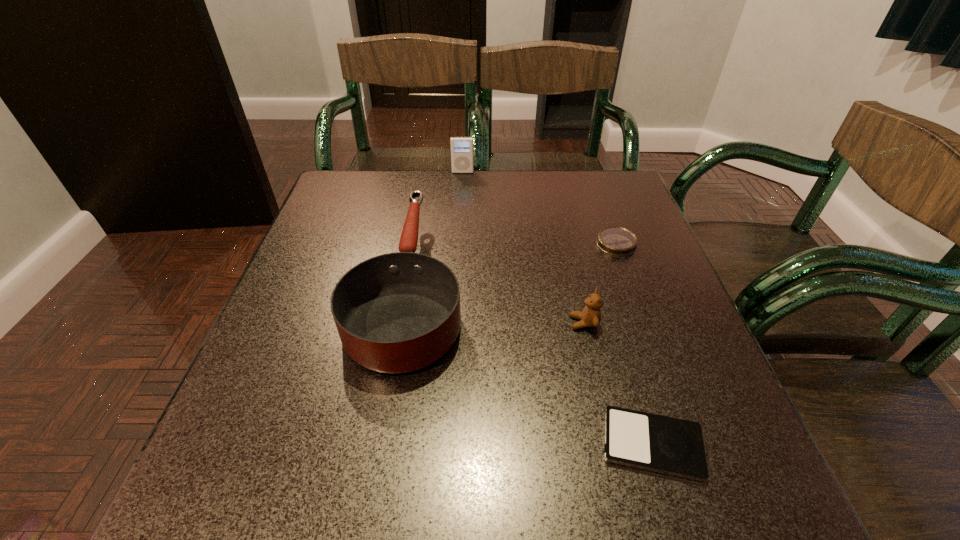
The image size is (960, 540). In order to click on the taller iPod in this screenshot , I will do `click(462, 159)`.

I want to click on the left iPod, so click(x=462, y=159).

The image size is (960, 540). What are the coordinates of `pan` in the screenshot? It's located at (399, 312).

Where is `the third tallest object`? the third tallest object is located at coordinates (591, 315).

At what (x,y) coordinates should I click in order to perform the action: click on compass. Please return your answer as a coordinate pair (x, y). The width and height of the screenshot is (960, 540). Looking at the image, I should click on (617, 241).

Locate an element on the screen. the shortest object is located at coordinates 657,443.

In order to click on the shorter iPod in this screenshot , I will do `click(657, 443)`.

Locate an element on the screen. The width and height of the screenshot is (960, 540). free space located 0.180m on the front-facing side of the farther iPod is located at coordinates (461, 210).

Find the location of a particular element. The width and height of the screenshot is (960, 540). free space located 0.080m on the handle side of the pan is located at coordinates (423, 201).

Find the location of `free space located 0.120m on the handle side of the pan`. free space located 0.120m on the handle side of the pan is located at coordinates (424, 193).